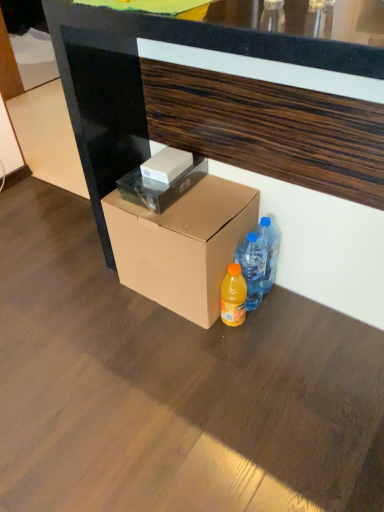
Describe the element at coordinates (269, 250) in the screenshot. I see `blue translucent water bottles at lower right, which is the second bottle in left-to-right order` at that location.

At what (x,y) coordinates should I click in order to perform the action: click on white glossy box at center, placed as the 2th box when sorted from bottom to top. Please return your answer as a coordinate pair (x, y). Looking at the image, I should click on (160, 186).

Identify the location of brown cardboard box at lower center, the first box ordered from the bottom. (182, 245).

From the image's perspective, is translucent plastic bottle at lower right, which is the 1th bottle from left to right, on top of white matte box at center, positioned as the third box in bottom-to-top order?

No, from the image's perspective, translucent plastic bottle at lower right, which is the 1th bottle from left to right, is not over white matte box at center, positioned as the third box in bottom-to-top order.

This screenshot has height=512, width=384. What are the coordinates of `box behind the translucent plastic bottle at lower right, which is the 1th bottle from left to right` in the screenshot? It's located at (166, 165).

From a real-world perspective, relative to white matte box at center, positioned as the third box in bottom-to-top order, is translucent plastic bottle at lower right, the second bottle in the right-to-left sequence, vertically above or below?

Result: From a real-world perspective, translucent plastic bottle at lower right, the second bottle in the right-to-left sequence, is physically below white matte box at center, positioned as the third box in bottom-to-top order.

Between translucent plastic bottle at lower right, the second bottle in the right-to-left sequence, and white matte box at center, acting as the first box starting from the top, which one appears on the left side from the viewer's perspective?

Positioned to the left is white matte box at center, acting as the first box starting from the top.

In the scene shown: From the image's perspective, which one is positioned higher, brown wood desk at center or white matte box at center, acting as the first box starting from the top?

brown wood desk at center is shown above in the image.

From a real-world perspective, is brown wood desk at center physically located above or below white matte box at center, acting as the first box starting from the top?

Clearly, from a real-world perspective, brown wood desk at center is above white matte box at center, acting as the first box starting from the top.

Can you confirm if brown wood desk at center is positioned to the right of white matte box at center, acting as the first box starting from the top?

Correct, you'll find brown wood desk at center to the right of white matte box at center, acting as the first box starting from the top.

Is brown wood desk at center smaller than white matte box at center, acting as the first box starting from the top?

Actually, brown wood desk at center might be larger than white matte box at center, acting as the first box starting from the top.

Looking at this image, which of these two, white glossy box at center, placed as the 2th box when sorted from bottom to top, or white matte box at center, positioned as the third box in bottom-to-top order, is thinner?

With smaller width is white matte box at center, positioned as the third box in bottom-to-top order.

Relative to white matte box at center, positioned as the third box in bottom-to-top order, is white glossy box at center, marked as the second box in a top-to-bottom arrangement, in front or behind?

white glossy box at center, marked as the second box in a top-to-bottom arrangement, is positioned closer to the viewer than white matte box at center, positioned as the third box in bottom-to-top order.

In terms of height, does white glossy box at center, placed as the 2th box when sorted from bottom to top, look taller or shorter compared to white matte box at center, positioned as the third box in bottom-to-top order?

Clearly, white glossy box at center, placed as the 2th box when sorted from bottom to top, is shorter compared to white matte box at center, positioned as the third box in bottom-to-top order.

Is white glossy box at center, placed as the 2th box when sorted from bottom to top, located outside white matte box at center, positioned as the third box in bottom-to-top order?

No, white glossy box at center, placed as the 2th box when sorted from bottom to top, is inside or overlapping with white matte box at center, positioned as the third box in bottom-to-top order.

Do you think brown cardboard box at lower center, the 3th box from the top, is within translucent plastic bottle at lower right, which is the 1th bottle from left to right, or outside of it?

brown cardboard box at lower center, the 3th box from the top, exists outside the volume of translucent plastic bottle at lower right, which is the 1th bottle from left to right.

Which point is more forward, (167, 227) or (255, 271)?

The point (167, 227) is closer.

Is blue translucent water bottles at lower right, which is the second bottle in left-to-right order, bigger than brown cardboard box at lower center, the first box ordered from the bottom?

No, blue translucent water bottles at lower right, which is the second bottle in left-to-right order, is not bigger than brown cardboard box at lower center, the first box ordered from the bottom.

Based on the photo, can you tell me how much blue translucent water bottles at lower right, which is the 1th bottle from right to left, and brown cardboard box at lower center, the 3th box from the top, differ in facing direction?

0.00288 degrees.

From a real-world perspective, does blue translucent water bottles at lower right, which is the second bottle in left-to-right order, stand above brown cardboard box at lower center, the 3th box from the top?

No, from a real-world perspective, blue translucent water bottles at lower right, which is the second bottle in left-to-right order, is not on top of brown cardboard box at lower center, the 3th box from the top.

Is blue translucent water bottles at lower right, which is the 1th bottle from right to left, positioned beyond the bounds of brown cardboard box at lower center, the first box ordered from the bottom?

blue translucent water bottles at lower right, which is the 1th bottle from right to left, is positioned outside brown cardboard box at lower center, the first box ordered from the bottom.

Is point (248, 253) closer to viewer compared to point (197, 106)?

No, (248, 253) is behind (197, 106).

From a real-world perspective, is translucent plastic bottle at lower right, the second bottle in the right-to-left sequence, above or below brown wood desk at center?

From a real-world perspective, translucent plastic bottle at lower right, the second bottle in the right-to-left sequence, is physically below brown wood desk at center.

How many degrees apart are the facing directions of translucent plastic bottle at lower right, the second bottle in the right-to-left sequence, and brown wood desk at center?

translucent plastic bottle at lower right, the second bottle in the right-to-left sequence, and brown wood desk at center are facing 0.399 degrees away from each other.

Is translucent plastic bottle at lower right, the second bottle in the right-to-left sequence, aimed at brown wood desk at center?

No, translucent plastic bottle at lower right, the second bottle in the right-to-left sequence, is not aimed at brown wood desk at center.

You are a GUI agent. You are given a task and a screenshot of the screen. Output one action in this format:
    pyautogui.click(x=<x>, y=<y>)
    Task: Click on the desk above the white glossy box at center, marked as the second box in a top-to-bottom arrangement (from a real-world perspective)
    This screenshot has width=384, height=512.
    Given the screenshot: What is the action you would take?
    (x=228, y=101)

Based on the photo, from a real-world perspective, is brown wood desk at center on white glossy box at center, placed as the 2th box when sorted from bottom to top?

Indeed, from a real-world perspective, brown wood desk at center stands above white glossy box at center, placed as the 2th box when sorted from bottom to top.

From the image's perspective, which is above, brown wood desk at center or white glossy box at center, marked as the second box in a top-to-bottom arrangement?

brown wood desk at center appears higher in the image.

Is brown wood desk at center aimed at white glossy box at center, marked as the second box in a top-to-bottom arrangement?

Yes, brown wood desk at center is oriented towards white glossy box at center, marked as the second box in a top-to-bottom arrangement.

What are the coordinates of `bottle in front of the white matte box at center, acting as the first box starting from the top` in the screenshot? It's located at (252, 268).

The height and width of the screenshot is (512, 384). Identify the location of the 2nd box to the left when counting from the brown wood desk at center. (166, 165).

Looking at the image, which one is located closer to white matte box at center, acting as the first box starting from the top, brown wood desk at center or white glossy box at center, marked as the second box in a top-to-bottom arrangement?

white glossy box at center, marked as the second box in a top-to-bottom arrangement, is positioned closer to the anchor white matte box at center, acting as the first box starting from the top.

Which object lies nearer to the anchor point brown cardboard box at lower center, the first box ordered from the bottom, blue translucent water bottles at lower right, which is the second bottle in left-to-right order, or brown wood desk at center?

Based on the image, brown wood desk at center appears to be nearer to brown cardboard box at lower center, the first box ordered from the bottom.

Based on their spatial positions, is blue translucent water bottles at lower right, which is the second bottle in left-to-right order, or brown wood desk at center closer to white matte box at center, positioned as the third box in bottom-to-top order?

Among the two, brown wood desk at center is located nearer to white matte box at center, positioned as the third box in bottom-to-top order.

Looking at this image, looking at the image, which one is located closer to brown cardboard box at lower center, the first box ordered from the bottom, translucent plastic bottle at lower right, which is the 1th bottle from left to right, or white glossy box at center, marked as the second box in a top-to-bottom arrangement?

Based on the image, white glossy box at center, marked as the second box in a top-to-bottom arrangement, appears to be nearer to brown cardboard box at lower center, the first box ordered from the bottom.

Estimate the real-world distances between objects in this image. Which object is closer to translucent plastic bottle at lower right, which is the 1th bottle from left to right, white matte box at center, positioned as the third box in bottom-to-top order, or blue translucent water bottles at lower right, which is the second bottle in left-to-right order?

Based on the image, blue translucent water bottles at lower right, which is the second bottle in left-to-right order, appears to be nearer to translucent plastic bottle at lower right, which is the 1th bottle from left to right.

Which object lies nearer to the anchor point white matte box at center, positioned as the third box in bottom-to-top order, translucent plastic bottle at lower right, the second bottle in the right-to-left sequence, or blue translucent water bottles at lower right, which is the second bottle in left-to-right order?

translucent plastic bottle at lower right, the second bottle in the right-to-left sequence, lies closer to white matte box at center, positioned as the third box in bottom-to-top order, than the other object.

Looking at this image, which object lies further to the anchor point brown wood desk at center, translucent plastic bottle at lower right, which is the 1th bottle from left to right, or brown cardboard box at lower center, the first box ordered from the bottom?

The object further to brown wood desk at center is translucent plastic bottle at lower right, which is the 1th bottle from left to right.

Based on their spatial positions, is blue translucent water bottles at lower right, which is the 1th bottle from right to left, or white glossy box at center, placed as the 2th box when sorted from bottom to top, closer to translucent plastic bottle at lower right, the second bottle in the right-to-left sequence?

Among the two, blue translucent water bottles at lower right, which is the 1th bottle from right to left, is located nearer to translucent plastic bottle at lower right, the second bottle in the right-to-left sequence.

The height and width of the screenshot is (512, 384). I want to click on box between white matte box at center, acting as the first box starting from the top, and brown cardboard box at lower center, the first box ordered from the bottom, in the up-down direction, so click(160, 186).

Find the location of a particular element. This screenshot has width=384, height=512. box between white matte box at center, acting as the first box starting from the top, and blue translucent water bottles at lower right, which is the 1th bottle from right to left, from left to right is located at coordinates (182, 245).

Locate an element on the screen. bottle located between brown wood desk at center and blue translucent water bottles at lower right, which is the 1th bottle from right to left, in the depth direction is located at coordinates (252, 268).

At what (x,y) coordinates should I click in order to perform the action: click on bottle located between brown cardboard box at lower center, the first box ordered from the bottom, and blue translucent water bottles at lower right, which is the 1th bottle from right to left, in the left-right direction. Please return your answer as a coordinate pair (x, y). Looking at the image, I should click on (252, 268).